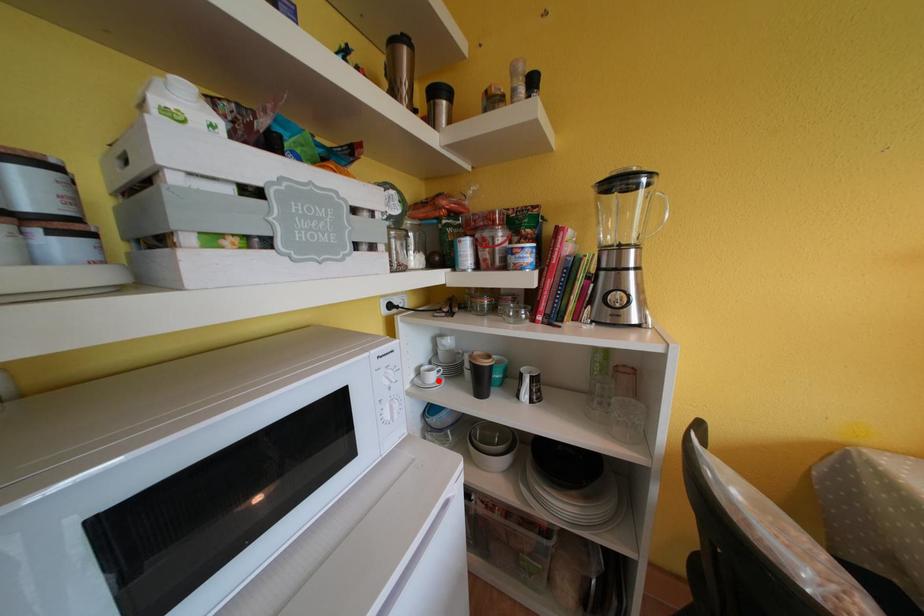
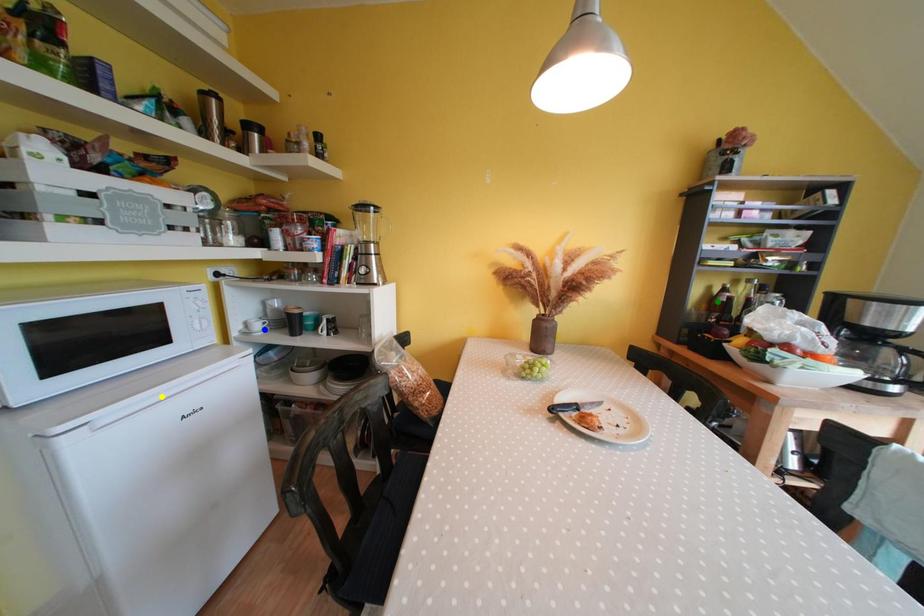
Question: I am providing you with two images of the same scene from different viewpoints. A red point is marked on the first image. You are given multiple points on the second image. In image 2, which mark is for the same physical point as the one in image 1?

Choices:
 (A) green point
 (B) yellow point
 (C) blue point

Answer: (C)